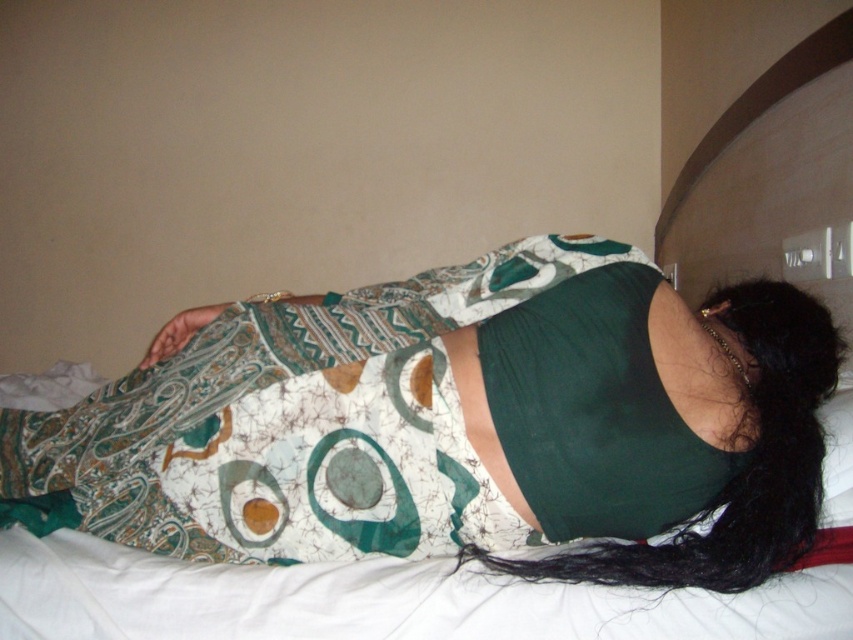
Question: Which point is closer to the camera?

Choices:
 (A) (682, 440)
 (B) (279, 531)

Answer: (A)

Question: Is printed fabric dress at center below black silky hair at center?

Choices:
 (A) no
 (B) yes

Answer: (B)

Question: Which of the following is the farthest from the observer?

Choices:
 (A) black silky hair at center
 (B) printed fabric dress at center

Answer: (B)

Question: Does printed fabric dress at center appear under black silky hair at center?

Choices:
 (A) no
 (B) yes

Answer: (B)

Question: Can you confirm if printed fabric dress at center is smaller than black silky hair at center?

Choices:
 (A) no
 (B) yes

Answer: (A)